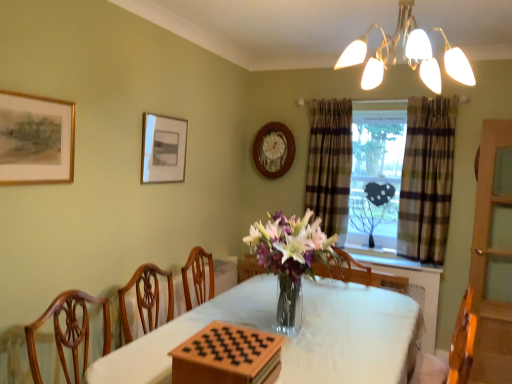
Measure the distance between wooden board game at center and camera.

A distance of 4.58 feet exists between wooden board game at center and camera.

Measure the distance between point (x=376, y=51) and camera.

The distance of point (x=376, y=51) from camera is 7.40 feet.

The image size is (512, 384). What are the coordinates of `white cloth-covered table at center` in the screenshot? It's located at (352, 335).

The height and width of the screenshot is (384, 512). In order to click on translucent glass vase at center in this screenshot , I will do `click(290, 259)`.

Where is `wooden board game at center`? The width and height of the screenshot is (512, 384). wooden board game at center is located at coordinates (227, 356).

Does plaid fabric curtain at window, arranged as the 2th curtain when viewed from the left, turn towards plaid fabric curtain at center, which ranks as the 2th curtain in right-to-left order?

No, plaid fabric curtain at window, arranged as the 2th curtain when viewed from the left, is not facing towards plaid fabric curtain at center, which ranks as the 2th curtain in right-to-left order.

Is point (436, 145) positioned after point (339, 103)?

No.

Does plaid fabric curtain at window, arranged as the 2th curtain when viewed from the left, touch plaid fabric curtain at center, which ranks as the 1th curtain in left-to-right order?

plaid fabric curtain at window, arranged as the 2th curtain when viewed from the left, and plaid fabric curtain at center, which ranks as the 1th curtain in left-to-right order, are not in contact.

Is plaid fabric curtain at window, arranged as the 2th curtain when viewed from the left, further to camera compared to plaid fabric curtain at center, which ranks as the 1th curtain in left-to-right order?

No, plaid fabric curtain at window, arranged as the 2th curtain when viewed from the left, is closer to the viewer.

Which is in front, plaid fabric curtain at window, arranged as the 2th curtain when viewed from the left, or gold-framed painting at upper left, the first picture frame positioned from the left?

gold-framed painting at upper left, the first picture frame positioned from the left.

Considering the points (451, 101) and (9, 107), which point is behind, point (451, 101) or point (9, 107)?

Positioned behind is point (451, 101).

Measure the distance between plaid fabric curtain at window, arranged as the 2th curtain when viewed from the left, and gold-framed painting at upper left, positioned as the 3th picture frame in back-to-front order.

The distance of plaid fabric curtain at window, arranged as the 2th curtain when viewed from the left, from gold-framed painting at upper left, positioned as the 3th picture frame in back-to-front order, is 8.44 feet.

Considering the sizes of objects plaid fabric curtain at window, arranged as the 2th curtain when viewed from the left, and gold-framed painting at upper left, the first picture frame positioned from the left, in the image provided, who is bigger, plaid fabric curtain at window, arranged as the 2th curtain when viewed from the left, or gold-framed painting at upper left, the first picture frame positioned from the left,?

plaid fabric curtain at window, arranged as the 2th curtain when viewed from the left.

Does wooden board game at center have a larger size compared to matte white picture frame at upper left, which is counted as the second picture frame, starting from the right?

Yes.

From a real-world perspective, who is located higher, wooden board game at center or matte white picture frame at upper left, which is counted as the second picture frame, starting from the right?

matte white picture frame at upper left, which is counted as the second picture frame, starting from the right, is physically above.

Is wooden board game at center looking in the opposite direction of matte white picture frame at upper left, the 2th picture frame viewed from the front?

No.

Would you say matte gold chandelier at upper center is to the left or to the right of translucent glass vase at center in the picture?

Based on their positions, matte gold chandelier at upper center is located to the right of translucent glass vase at center.

Between matte gold chandelier at upper center and translucent glass vase at center, which one has smaller size?

Smaller between the two is matte gold chandelier at upper center.

From a real-world perspective, between matte gold chandelier at upper center and translucent glass vase at center, who is vertically lower?

translucent glass vase at center, from a real-world perspective.

From the image's perspective, is matte gold chandelier at upper center below translucent glass vase at center?

No, from the image's perspective, matte gold chandelier at upper center is not beneath translucent glass vase at center.

Considering the points (428, 202) and (251, 369), which point is behind, point (428, 202) or point (251, 369)?

The point (428, 202) is more distant.

From the image's perspective, does plaid fabric curtain at window, positioned as the first curtain in right-to-left order, appear higher than wooden board game at center?

Yes, from the image's perspective, plaid fabric curtain at window, positioned as the first curtain in right-to-left order, is over wooden board game at center.

Considering the sizes of objects plaid fabric curtain at window, arranged as the 2th curtain when viewed from the left, and wooden board game at center in the image provided, who is smaller, plaid fabric curtain at window, arranged as the 2th curtain when viewed from the left, or wooden board game at center?

wooden board game at center is smaller.

How different are the orientations of plaid fabric window at center and wooden clock at upper center, placed as the first picture frame when sorted from right to left, in degrees?

plaid fabric window at center and wooden clock at upper center, placed as the first picture frame when sorted from right to left, are facing 1.25 degrees away from each other.

Is plaid fabric window at center facing towards wooden clock at upper center, placed as the first picture frame when sorted from right to left?

No, plaid fabric window at center is not turned towards wooden clock at upper center, placed as the first picture frame when sorted from right to left.

Can you confirm if plaid fabric window at center is wider than wooden clock at upper center, placed as the first picture frame when sorted from right to left?

Yes.

Which is closer to the camera, (x=338, y=211) or (x=280, y=154)?

Clearly, point (x=338, y=211) is closer to the camera than point (x=280, y=154).

Consider the image. In the image, is gold-framed painting at upper left, the first picture frame positioned from the left, on the left side or the right side of plaid fabric curtain at center, which ranks as the 2th curtain in right-to-left order?

gold-framed painting at upper left, the first picture frame positioned from the left, is to the left of plaid fabric curtain at center, which ranks as the 2th curtain in right-to-left order.

In the scene shown: Considering the relative sizes of gold-framed painting at upper left, placed as the 1th picture frame when sorted from front to back, and plaid fabric curtain at center, which ranks as the 2th curtain in right-to-left order, in the image provided, is gold-framed painting at upper left, placed as the 1th picture frame when sorted from front to back, wider than plaid fabric curtain at center, which ranks as the 2th curtain in right-to-left order,?

In fact, gold-framed painting at upper left, placed as the 1th picture frame when sorted from front to back, might be narrower than plaid fabric curtain at center, which ranks as the 2th curtain in right-to-left order.

From a real-world perspective, is gold-framed painting at upper left, placed as the 1th picture frame when sorted from front to back, physically above plaid fabric curtain at center, which ranks as the 2th curtain in right-to-left order?

Yes, from a real-world perspective, gold-framed painting at upper left, placed as the 1th picture frame when sorted from front to back, is on top of plaid fabric curtain at center, which ranks as the 2th curtain in right-to-left order.

In the image, is gold-framed painting at upper left, placed as the 1th picture frame when sorted from front to back, positioned in front of or behind plaid fabric curtain at center, which ranks as the 1th curtain in left-to-right order?

gold-framed painting at upper left, placed as the 1th picture frame when sorted from front to back, is positioned closer to the viewer than plaid fabric curtain at center, which ranks as the 1th curtain in left-to-right order.

You are a GUI agent. You are given a task and a screenshot of the screen. Output one action in this format:
    pyautogui.click(x=<x>, y=<y>)
    Task: Click on the curtain that is above the plaid fabric curtain at window, positioned as the first curtain in right-to-left order (from the image's perspective)
    The width and height of the screenshot is (512, 384).
    Given the screenshot: What is the action you would take?
    pyautogui.click(x=330, y=164)

Starting from the plaid fabric curtain at window, positioned as the first curtain in right-to-left order, which picture frame is the 2nd one in front? Please provide its 2D coordinates.

[(36, 139)]

Estimate the real-world distances between objects in this image. Which object is closer to wooden clock at upper center, placed as the first picture frame when sorted from right to left, plaid fabric curtain at window, arranged as the 2th curtain when viewed from the left, or wooden board game at center?

The object closer to wooden clock at upper center, placed as the first picture frame when sorted from right to left, is plaid fabric curtain at window, arranged as the 2th curtain when viewed from the left.

Based on the photo, estimate the real-world distances between objects in this image. Which object is further from wooden clock at upper center, placed as the first picture frame when sorted from back to front, translucent glass vase at center or white cloth-covered table at center?

translucent glass vase at center is positioned further to the anchor wooden clock at upper center, placed as the first picture frame when sorted from back to front.

Consider the image. Estimate the real-world distances between objects in this image. Which object is further from white cloth-covered table at center, plaid fabric window at center or matte white picture frame at upper left, the 2th picture frame viewed from the front?

Based on the image, plaid fabric window at center appears to be further to white cloth-covered table at center.

Considering their positions, is gold-framed painting at upper left, positioned as the 3th picture frame in back-to-front order, positioned further to wooden board game at center than white cloth-covered table at center?

gold-framed painting at upper left, positioned as the 3th picture frame in back-to-front order, is further to wooden board game at center.

When comparing their distances from wooden board game at center, does gold-framed painting at upper left, placed as the 1th picture frame when sorted from front to back, or translucent glass vase at center seem closer?

Based on the image, translucent glass vase at center appears to be nearer to wooden board game at center.

Estimate the real-world distances between objects in this image. Which object is closer to white cloth-covered table at center, gold-framed painting at upper left, placed as the 1th picture frame when sorted from front to back, or wooden clock at upper center, placed as the first picture frame when sorted from right to left?

The object closer to white cloth-covered table at center is gold-framed painting at upper left, placed as the 1th picture frame when sorted from front to back.

From the image, which object appears to be nearer to matte gold chandelier at upper center, wooden clock at upper center, positioned as the third picture frame in left-to-right order, or white cloth-covered table at center?

white cloth-covered table at center.

From the image, which object appears to be nearer to plaid fabric curtain at window, positioned as the first curtain in right-to-left order, wooden clock at upper center, which is the third picture frame in front-to-back order, or translucent glass vase at center?

wooden clock at upper center, which is the third picture frame in front-to-back order.

Identify the location of table between gold-framed painting at upper left, positioned as the 3th picture frame in back-to-front order, and translucent glass vase at center from left to right. (352, 335).

The image size is (512, 384). I want to click on floral arrangement between matte white picture frame at upper left, the 2th picture frame viewed from the front, and plaid fabric curtain at window, positioned as the first curtain in right-to-left order, from left to right, so (290, 259).

I want to click on board game positioned between matte gold chandelier at upper center and plaid fabric window at center from near to far, so click(x=227, y=356).

At what (x,y) coordinates should I click in order to perform the action: click on floral arrangement between wooden board game at center and matte white picture frame at upper left, the second picture frame positioned from the back, along the z-axis. Please return your answer as a coordinate pair (x, y). This screenshot has width=512, height=384. Looking at the image, I should click on (290, 259).